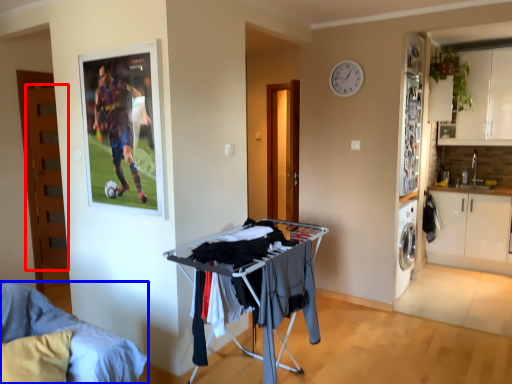
Question: Among these objects, which one is nearest to the camera, door (highlighted by a red box) or furniture (highlighted by a blue box)?

Choices:
 (A) door
 (B) furniture

Answer: (B)